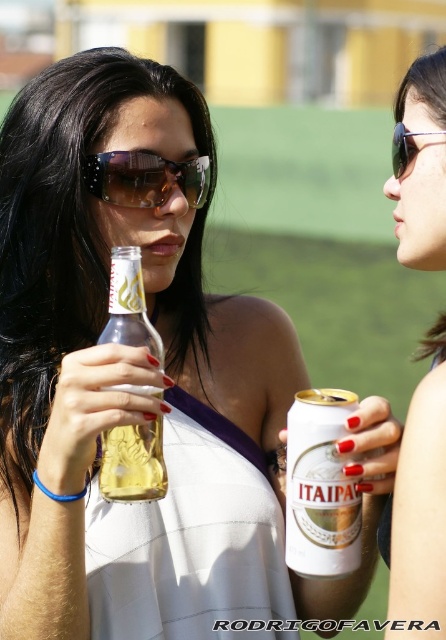
The height and width of the screenshot is (640, 446). What do you see at coordinates (421, 502) in the screenshot?
I see `matte black sunglasses at upper right` at bounding box center [421, 502].

Is matte black sunglasses at upper right to the left of sunglasses at upper right from the viewer's perspective?

In fact, matte black sunglasses at upper right is to the right of sunglasses at upper right.

Is point (445, 332) positioned behind point (393, 132)?

No, it is in front of (393, 132).

The width and height of the screenshot is (446, 640). In order to click on matte black sunglasses at upper right in this screenshot , I will do `click(421, 502)`.

From the picture: Which of these two, matte black sunglasses at upper right or gold metallic can at center, stands shorter?

With less height is gold metallic can at center.

Does matte black sunglasses at upper right appear over gold metallic can at center?

Yes.

Is point (429, 330) less distant than point (342, 531)?

No.

This screenshot has width=446, height=640. Identify the location of matte black sunglasses at upper right. (421, 502).

How far apart are matte black sunglasses at upper right and translucent glass bottle at center?

matte black sunglasses at upper right and translucent glass bottle at center are 20.06 inches apart.

Does matte black sunglasses at upper right have a lesser width compared to translucent glass bottle at center?

No.

The image size is (446, 640). I want to click on matte black sunglasses at upper right, so click(x=421, y=502).